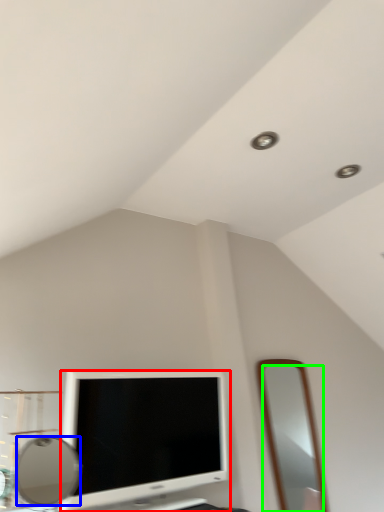
Question: Based on their relative distances, which object is farther from television (highlighted by a red box)? Choose from mirror (highlighted by a blue box) and mirror (highlighted by a green box).

Choices:
 (A) mirror
 (B) mirror

Answer: (B)